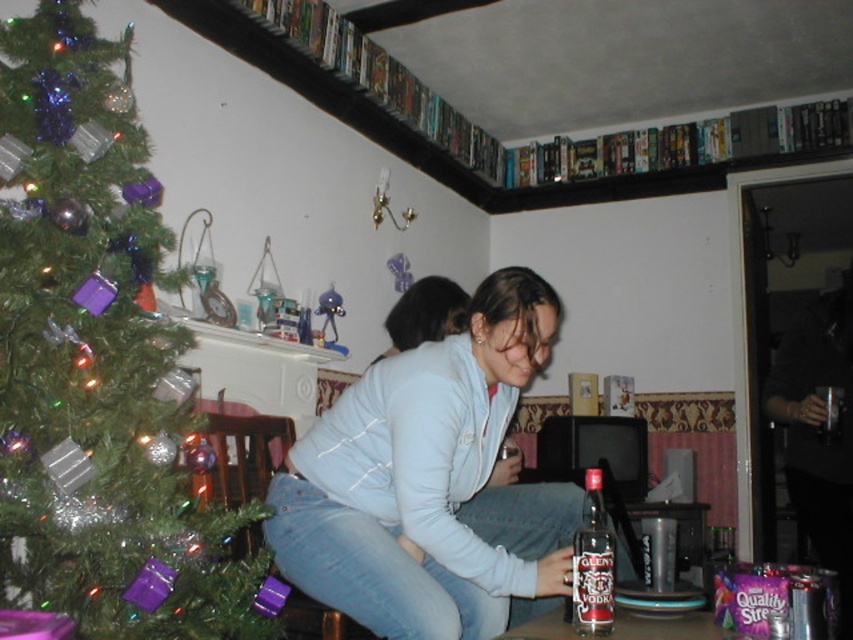
You are standing in the living room and want to place a 5 feet tall artificial tree in the corner where the green matte christmas tree at left is currently located. Can the existing space accommodate the new tree without moving any other furniture?

The green matte christmas tree at left is currently positioned 4.79 feet away from the viewer. Since the new tree is 5 feet tall, it may not fit in the space as the existing tree is already occupying the area and the distance might be insufficient. Consider measuring the exact dimensions of the space before deciding.

You are standing in the living room and want to place a small decoration on the table where the woman is sitting. There are two points marked on the table surface. The first point is at coordinates point (19, 582) and the second point is at point (575, 625). Which of these points is closer to the fireplace mantle where the tree is located?

Point (19, 582) is behind point (575, 625), so the point closer to the fireplace mantle is point (19, 582).